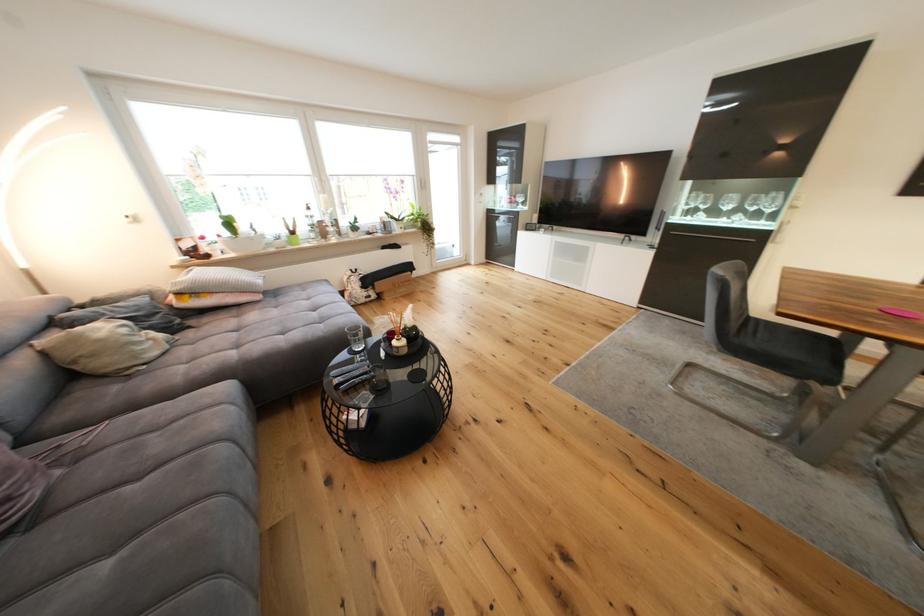
Which object does [103,347] point to?

It refers to a beige pillow.